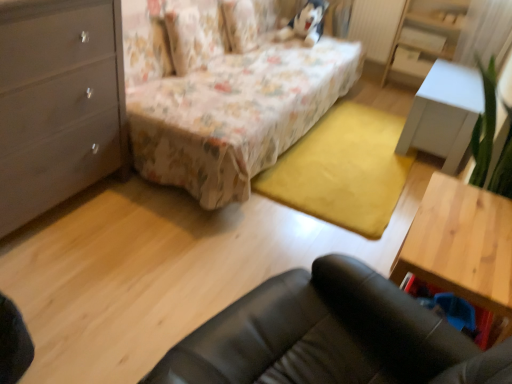
You are a GUI agent. You are given a task and a screenshot of the screen. Output one action in this format:
    pyautogui.click(x=<x>, y=<y>)
    Task: Click on the free space that is to the left of white glossy dresser at upper right
    The height and width of the screenshot is (384, 512).
    Given the screenshot: What is the action you would take?
    pyautogui.click(x=380, y=95)